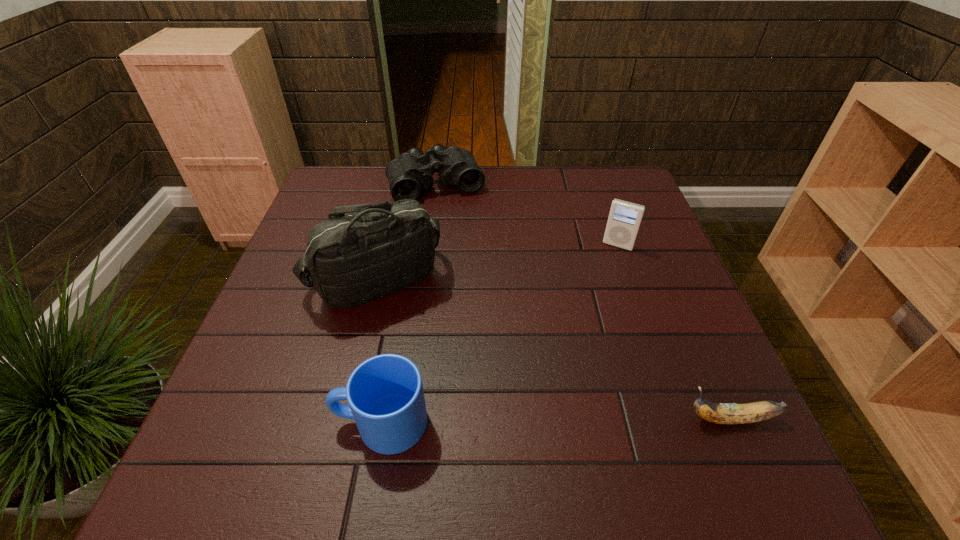
At what (x,y) coordinates should I click in order to perform the action: click on vacant space on the desktop that is between the mug and the shortest object and is positioned on the front-facing side of the iPod. Please return your answer as a coordinate pair (x, y). Looking at the image, I should click on (542, 421).

Locate an element on the screen. The image size is (960, 540). vacant spot on the desktop that is between the mug and the shortest object and is positioned at the front padded panel of the tallest object is located at coordinates (521, 421).

Locate an element on the screen. vacant space on the desktop that is between the mug and the banana and is positioned at the eyepieces of the binoculars is located at coordinates (533, 421).